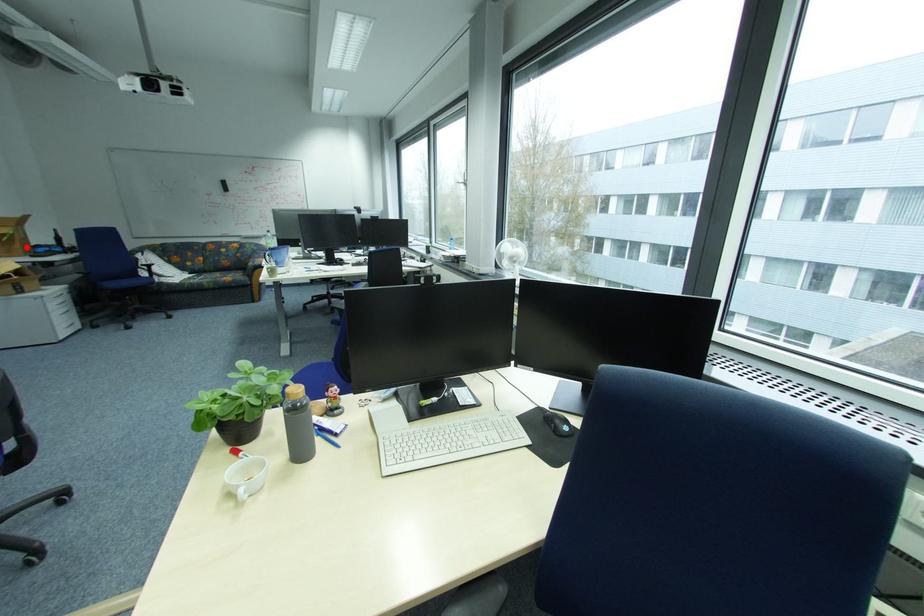
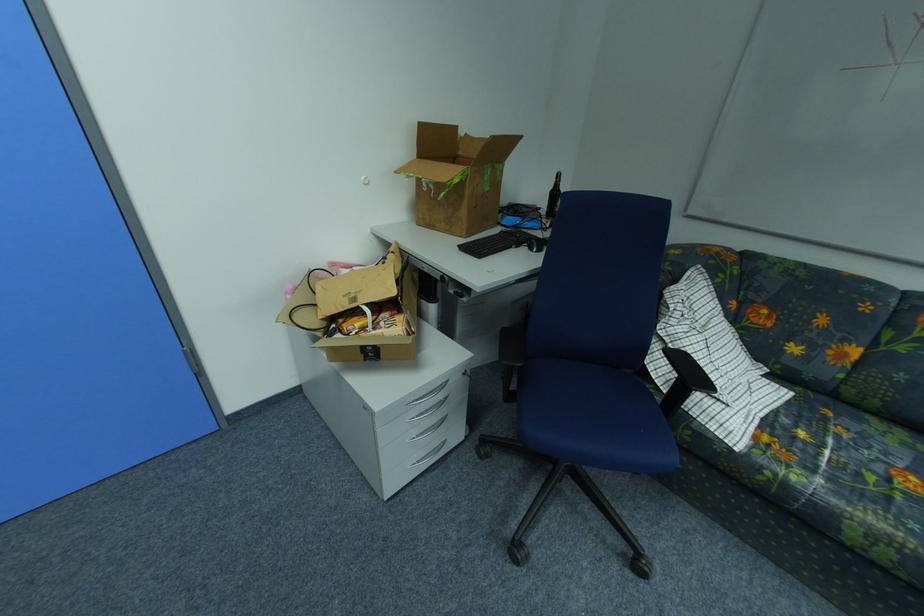
Locate, in the second image, the point that corresponds to the highlighted location in the first image.

(470, 214)